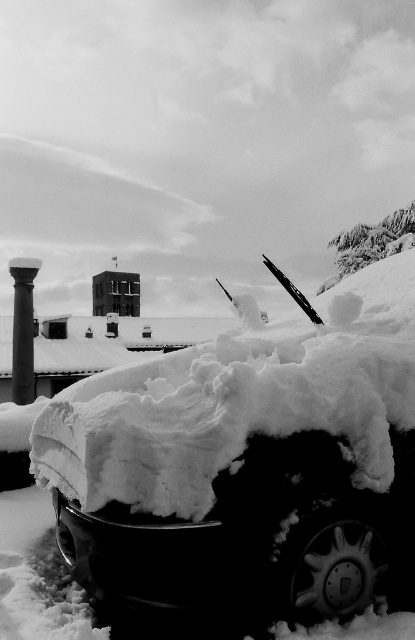
Does white fluffy snow at center appear over smooth black column at left?

Correct, white fluffy snow at center is located above smooth black column at left.

Is point (205, 436) positioned behind point (22, 289)?

No, (205, 436) is in front of (22, 289).

Does point (178, 476) come closer to viewer compared to point (38, 260)?

Yes.

This screenshot has width=415, height=640. Identify the location of white fluffy snow at center. (239, 403).